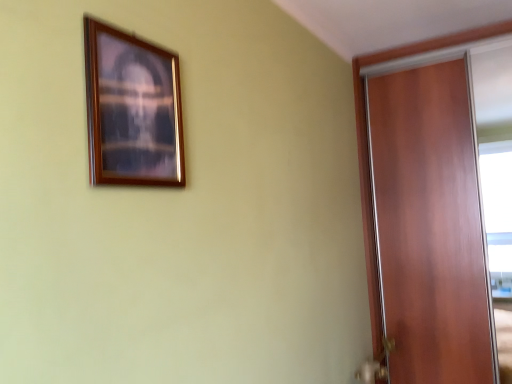
Question: Is wooden picture frame at upper left positioned with its back to wooden door at right?

Choices:
 (A) no
 (B) yes

Answer: (A)

Question: Does wooden picture frame at upper left have a greater height compared to wooden door at right?

Choices:
 (A) no
 (B) yes

Answer: (A)

Question: Are wooden picture frame at upper left and wooden door at right beside each other?

Choices:
 (A) no
 (B) yes

Answer: (A)

Question: From the image's perspective, is wooden picture frame at upper left located above wooden door at right?

Choices:
 (A) no
 (B) yes

Answer: (B)

Question: Can we say wooden picture frame at upper left lies outside wooden door at right?

Choices:
 (A) no
 (B) yes

Answer: (B)

Question: Is wooden picture frame at upper left further to the viewer compared to wooden door at right?

Choices:
 (A) yes
 (B) no

Answer: (B)

Question: Is gold metallic door handle at lower right to the left of wooden picture frame at upper left from the viewer's perspective?

Choices:
 (A) yes
 (B) no

Answer: (B)

Question: Is gold metallic door handle at lower right far from wooden picture frame at upper left?

Choices:
 (A) yes
 (B) no

Answer: (A)

Question: From the image's perspective, does gold metallic door handle at lower right appear higher than wooden picture frame at upper left?

Choices:
 (A) yes
 (B) no

Answer: (B)

Question: Is gold metallic door handle at lower right not inside wooden picture frame at upper left?

Choices:
 (A) yes
 (B) no

Answer: (A)

Question: From a real-world perspective, does gold metallic door handle at lower right sit lower than wooden picture frame at upper left?

Choices:
 (A) no
 (B) yes

Answer: (B)

Question: Considering the relative sizes of gold metallic door handle at lower right and wooden picture frame at upper left in the image provided, is gold metallic door handle at lower right shorter than wooden picture frame at upper left?

Choices:
 (A) yes
 (B) no

Answer: (A)

Question: Considering the relative positions of wooden door at right and wooden picture frame at upper left in the image provided, is wooden door at right to the right of wooden picture frame at upper left from the viewer's perspective?

Choices:
 (A) yes
 (B) no

Answer: (A)